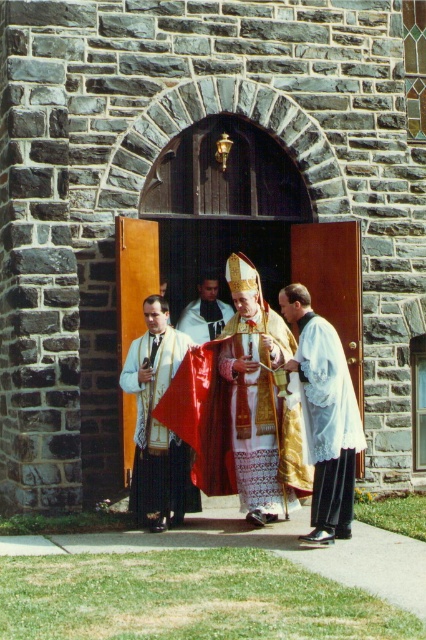
Is gold embroidered vestment at center below white silk robe at center?

Indeed, gold embroidered vestment at center is positioned under white silk robe at center.

Which is behind, point (224, 330) or point (176, 324)?

Point (176, 324)

Describe the element at coordinates (259, 412) in the screenshot. I see `gold embroidered vestment at center` at that location.

At what (x,y) coordinates should I click in order to perform the action: click on gold embroidered vestment at center. Please return your answer as a coordinate pair (x, y). This screenshot has height=640, width=426. Looking at the image, I should click on (259, 412).

Does white textured vestment at center appear over white silk robe at center?

No, white textured vestment at center is not above white silk robe at center.

Who is taller, white textured vestment at center or white silk robe at center?

white textured vestment at center

Describe the element at coordinates (158, 432) in the screenshot. I see `white textured vestment at center` at that location.

You are a GUI agent. You are given a task and a screenshot of the screen. Output one action in this format:
    pyautogui.click(x=<x>, y=<y>)
    Task: Click on the white textured vestment at center
    
    Given the screenshot: What is the action you would take?
    pyautogui.click(x=158, y=432)

Is gold embroidered vestment at center positioned at the back of white textured vestment at center?

No, gold embroidered vestment at center is closer to the viewer.

This screenshot has width=426, height=640. What do you see at coordinates (259, 412) in the screenshot?
I see `gold embroidered vestment at center` at bounding box center [259, 412].

Image resolution: width=426 pixels, height=640 pixels. Find the location of `gold embroidered vestment at center`. gold embroidered vestment at center is located at coordinates (259, 412).